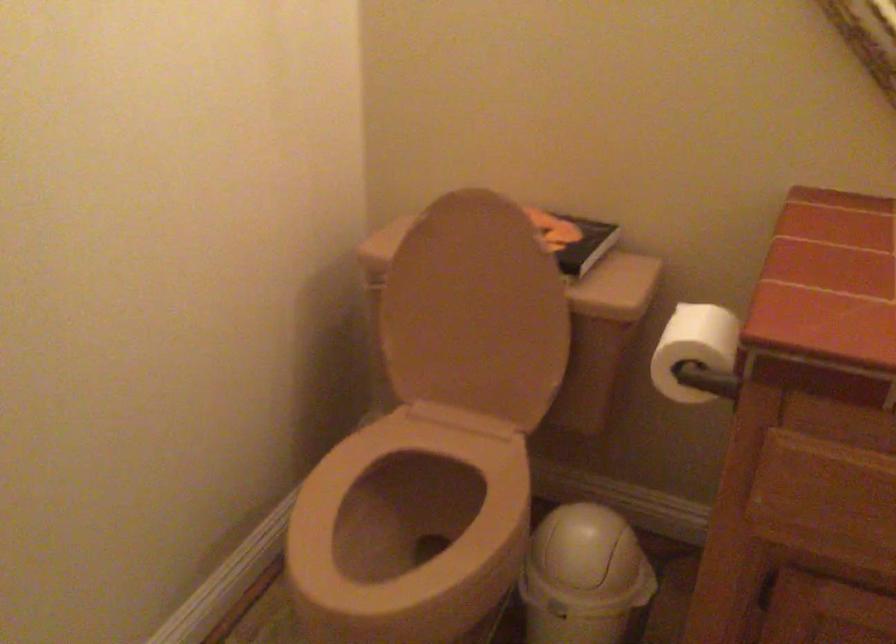
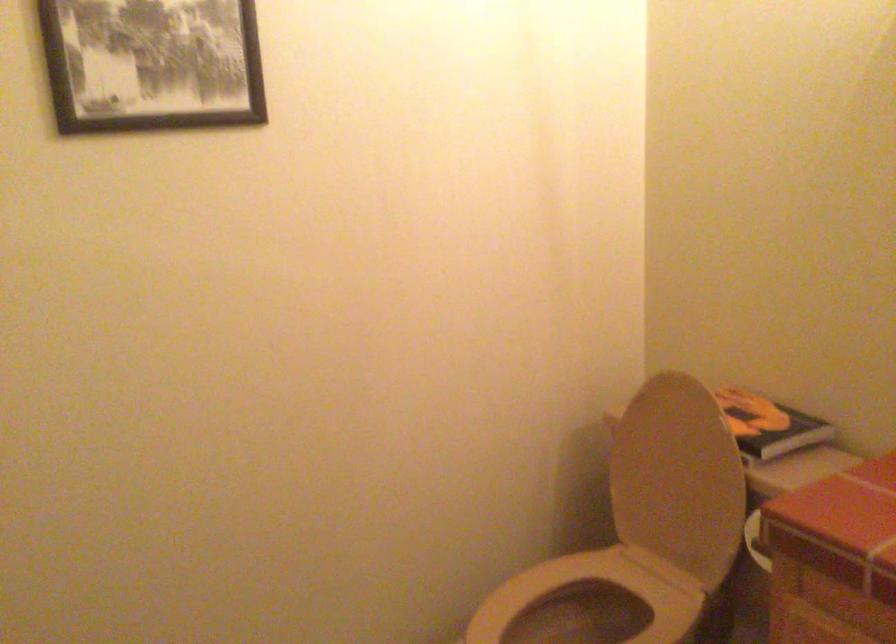
Where in the second image is the point corresponding to point (567, 241) from the first image?

(769, 426)